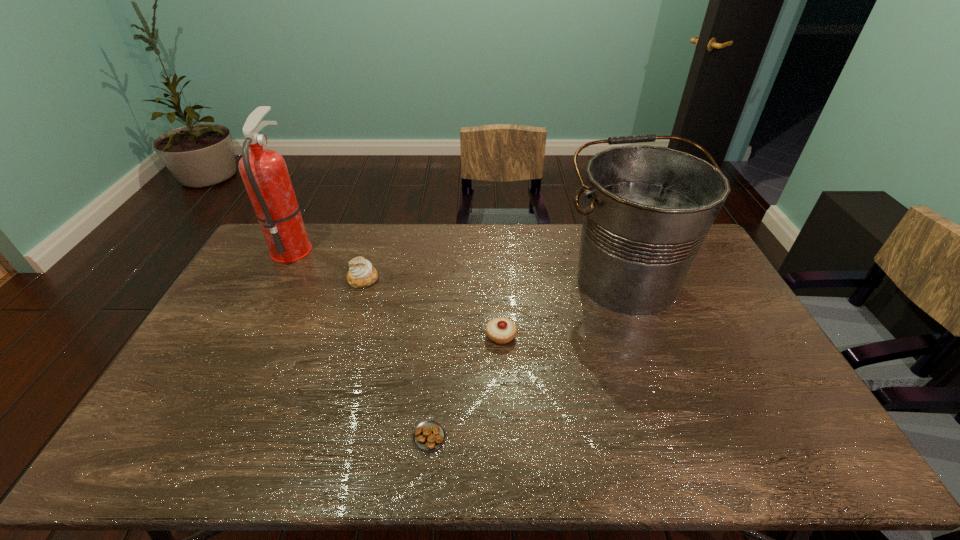
In order to click on vacant area that lies between the fire extinguisher and the rightmost object in this screenshot , I will do `click(459, 264)`.

What are the coordinates of `vacant space that's between the second nearest object and the leftmost object` in the screenshot? It's located at (397, 291).

Locate an element on the screen. free spot between the fire extinguisher and the rightmost object is located at coordinates (459, 264).

Locate an element on the screen. free point between the rightmost object and the fourth tallest object is located at coordinates (564, 308).

At what (x,y) coordinates should I click in order to perform the action: click on object that is the third closest to the second nearest pastry. Please return your answer as a coordinate pair (x, y). Looking at the image, I should click on (361, 273).

This screenshot has height=540, width=960. What are the coordinates of `object that stands as the second closest to the shortest object` in the screenshot? It's located at (647, 210).

Where is `the third closest pastry to the leftmost object`? the third closest pastry to the leftmost object is located at coordinates (429, 435).

Identify which pastry is located as the second nearest to the rightmost object. Please provide its 2D coordinates. Your answer should be formatted as a tuple, i.e. [(x, y)], where the tuple contains the x and y coordinates of a point satisfying the conditions above.

[(429, 435)]

Identify the location of vacant space that satisfies the following two spatial constraints: 1. on the front side of the rightmost pastry; 2. on the left side of the third shortest object. (347, 335).

Locate an element on the screen. The width and height of the screenshot is (960, 540). free space in the image that satisfies the following two spatial constraints: 1. on the back side of the shortest pastry; 2. with the handle and hose on the fire extinguisher is located at coordinates (447, 247).